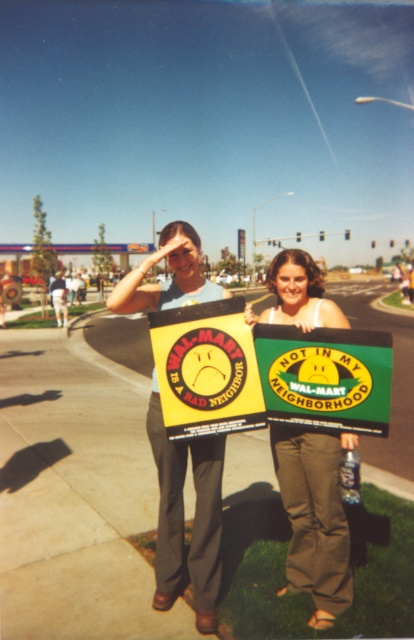
Question: Which object is positioned closest to the green fabric sign at center?

Choices:
 (A) green cotton tank top at center
 (B) light brown leather jacket at center
 (C) yellow matte sign at center

Answer: (C)

Question: Which point is farther from the camera taking this photo?

Choices:
 (A) (192, 252)
 (B) (226, 388)
 (C) (55, 314)
 (D) (370, 410)

Answer: (C)

Question: Which point is farther to the camera?

Choices:
 (A) green fabric sign at center
 (B) yellow matte sign at center
 (C) light brown leather jacket at center
 (D) green cotton tank top at center

Answer: (C)

Question: Can you confirm if yellow cardboard sign at center is thinner than green cotton tank top at center?

Choices:
 (A) no
 (B) yes

Answer: (B)

Question: Does yellow cardboard sign at center have a lesser width compared to green fabric sign at center?

Choices:
 (A) no
 (B) yes

Answer: (B)

Question: Does yellow cardboard sign at center have a greater width compared to yellow matte sign at center?

Choices:
 (A) no
 (B) yes

Answer: (A)